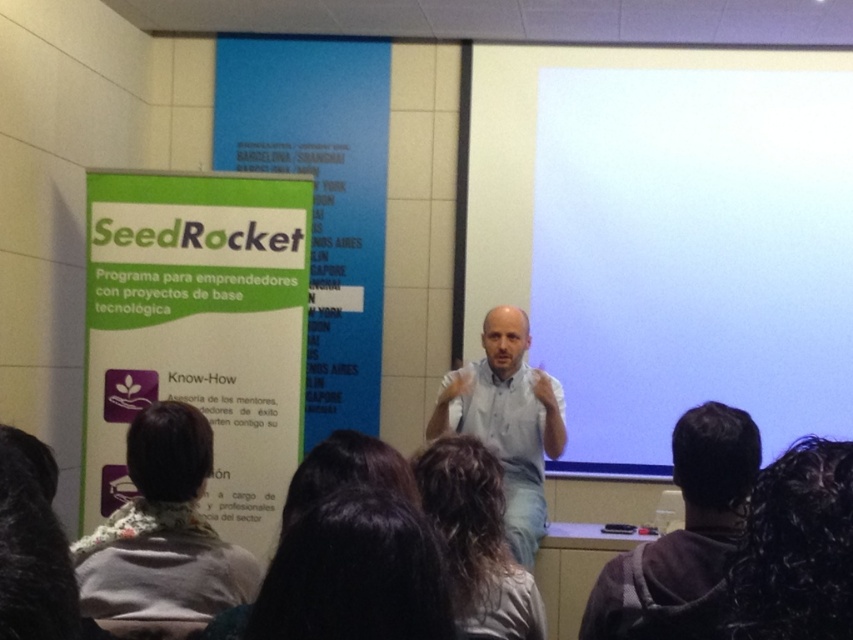
You are an attendee at this presentation and you want to take a photo of the speaker. The camera you have can only focus on one person at a time. Which person should you aim the camera at to capture the dark hair at lower center and the dark brown hair at lower center in the same frame?

The dark hair at lower center is above the dark brown hair at lower center, so you can aim the camera at the dark hair at lower center to include both in the frame since they are vertically aligned.

You are standing at the point labeled point (358, 547) and want to take a photo of the SeedRocket poster using a camera that has a 100mm focal length. The camera requires a minimum distance of 3 feet to focus properly. Will you be able to take a clear photo of the SeedRocket poster from your current position?

The point labeled point (358, 547) and the camera are 3.36 feet apart, which is slightly more than the 3 feet minimum distance required. Therefore, you can take a clear photo of the SeedRocket poster from your current position.

You are an attendee at this presentation. You need to locate the white matte projection screen at upper center and the dark gray hoodie at lower right. From your seated position in the audience, which object is higher in the visual field?

The white matte projection screen at upper center is above the dark gray hoodie at lower right, so from your seated position in the audience, the white matte projection screen at upper center is higher in the visual field.